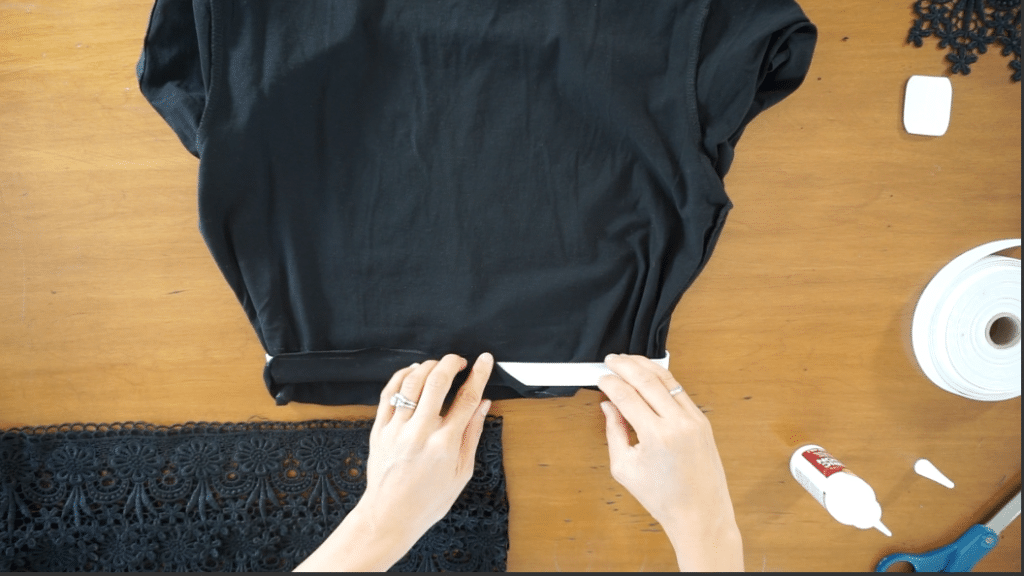
What are the coordinates of `table` in the screenshot? It's located at (765, 337).